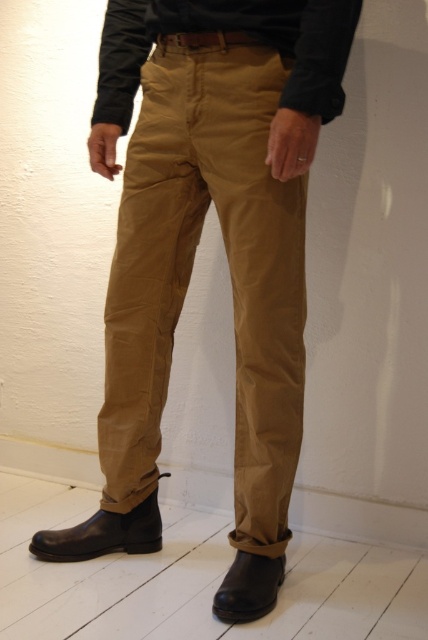
Does point (318, 97) lie in front of point (241, 573)?

Yes, it is in front of point (241, 573).

Is matte black shirt at center closer to camera compared to black leather boot at lower center?

Yes.

Image resolution: width=428 pixels, height=640 pixels. What do you see at coordinates (231, 33) in the screenshot?
I see `matte black shirt at center` at bounding box center [231, 33].

Locate an element on the screen. The height and width of the screenshot is (640, 428). matte black shirt at center is located at coordinates (231, 33).

Is black leather boot at lower left in front of black leather boot at lower center?

No, it is not.

Between black leather boot at lower left and black leather boot at lower center, which one appears on the left side from the viewer's perspective?

black leather boot at lower left is more to the left.

The image size is (428, 640). I want to click on black leather boot at lower left, so tap(103, 534).

Is tan cotton pants at center shorter than matte black shirt at center?

No.

Who is more distant from viewer, [177,236] or [112,12]?

The point [177,236] is more distant.

Locate an element on the screen. tan cotton pants at center is located at coordinates (190, 276).